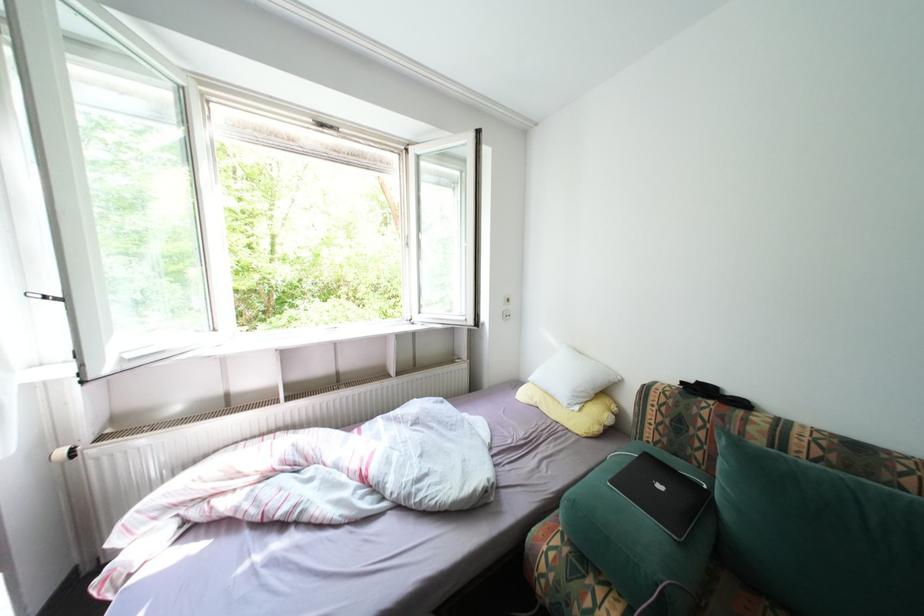
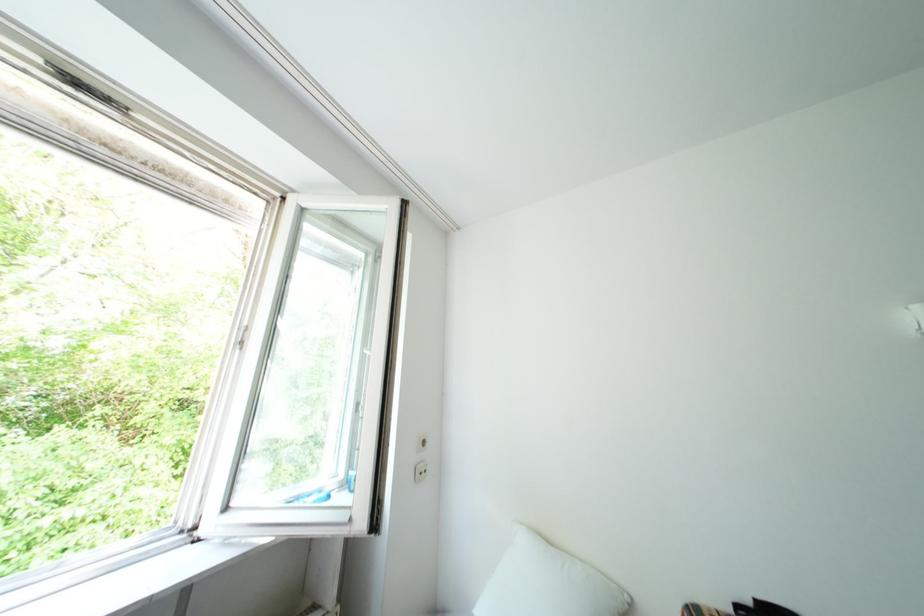
First-person continuous shooting, in which direction is the camera rotating?

The camera rotated toward right-up.